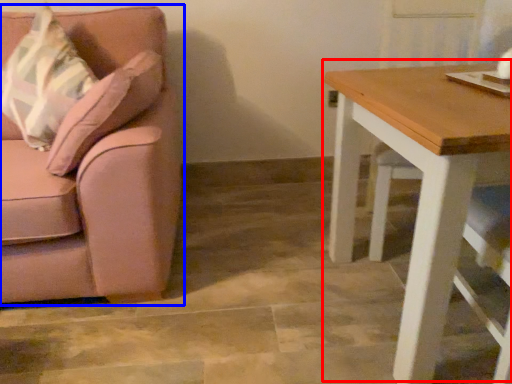
Question: Which object is closer to the camera taking this photo, table (highlighted by a red box) or chair (highlighted by a blue box)?

Choices:
 (A) table
 (B) chair

Answer: (A)